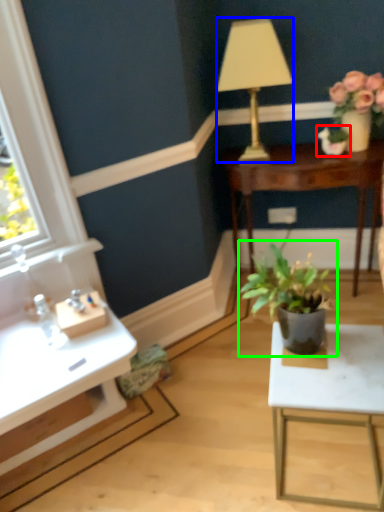
Question: Which object is positioned closest to houseplant (highlighted by a red box)? Select from lamp (highlighted by a blue box) and houseplant (highlighted by a green box).

Choices:
 (A) lamp
 (B) houseplant

Answer: (A)